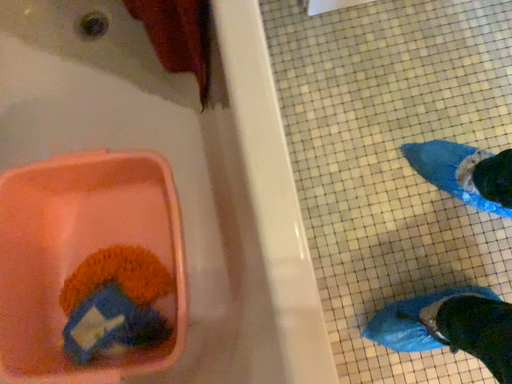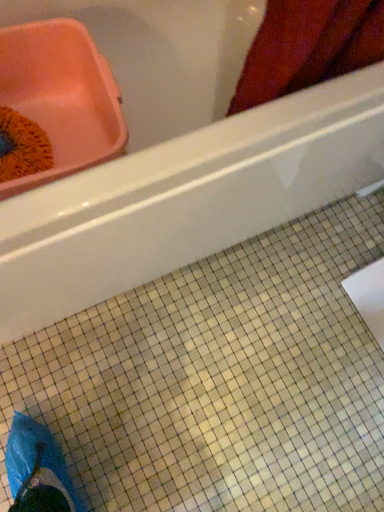
Question: How did the camera likely rotate when shooting the video?

Choices:
 (A) rotated upward
 (B) rotated downward

Answer: (A)